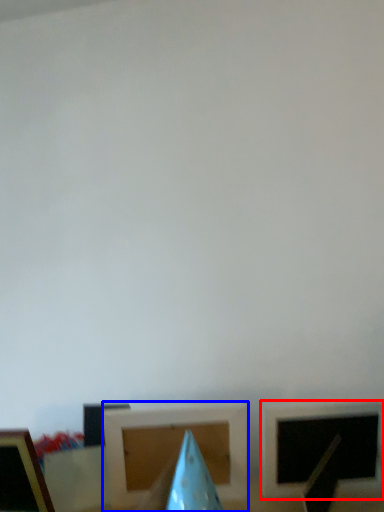
Question: Which of the following is the farthest to the observer, picture frame (highlighted by a red box) or picture frame (highlighted by a blue box)?

Choices:
 (A) picture frame
 (B) picture frame

Answer: (B)